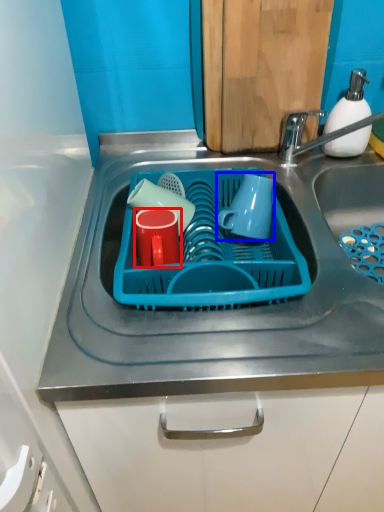
Question: Which object is further to the camera taking this photo, tableware (highlighted by a red box) or mug (highlighted by a blue box)?

Choices:
 (A) tableware
 (B) mug

Answer: (B)